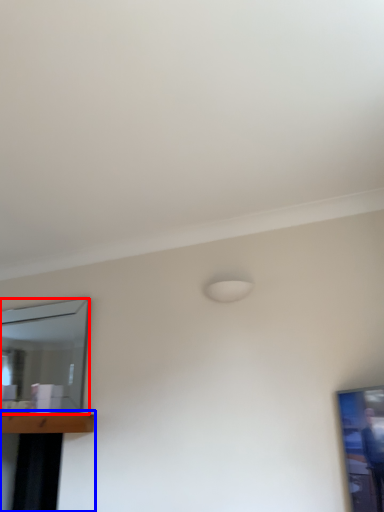
Question: Which object appears closest to the camera in this image, mirror (highlighted by a red box) or table (highlighted by a blue box)?

Choices:
 (A) mirror
 (B) table

Answer: (B)